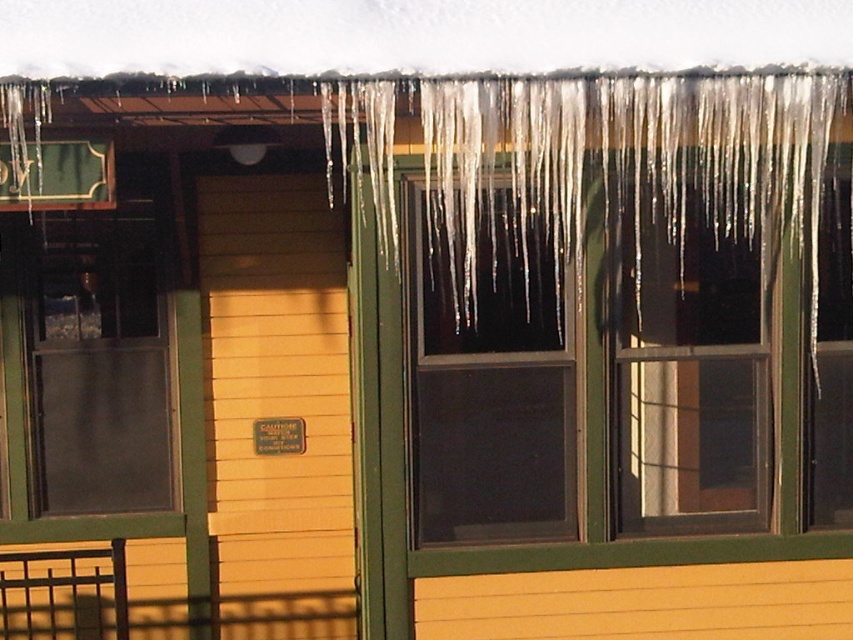
You are an architect inspecting the building. You notice two windows, the transparent glass window at center and the transparent glass window at left. Which window has a larger height?

The transparent glass window at center has a greater height compared to the transparent glass window at left.

You are standing in front of the building and notice two windows. The transparent glass window at upper center and the transparent glass window at left. Which window is positioned to the right side of the other?

The transparent glass window at upper center is to the right of the transparent glass window at left.